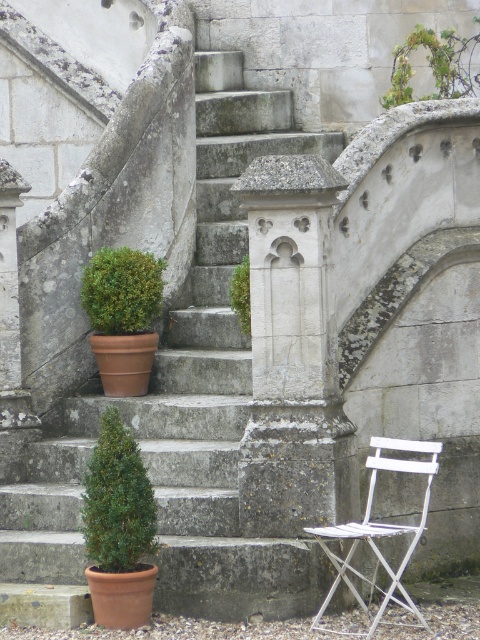
Is green matte hedge at lower left positioned before green mossy stone column at center?

Yes, it is.

Based on the photo, can you confirm if green matte hedge at lower left is positioned to the left of green mossy stone column at center?

Indeed, green matte hedge at lower left is positioned on the left side of green mossy stone column at center.

Image resolution: width=480 pixels, height=640 pixels. I want to click on green matte hedge at lower left, so click(118, 500).

Identify the location of smooth stone stairs at center. (177, 413).

Is point (51, 468) behind point (455, 77)?

That is False.

Where is `smooth stone stairs at center`? smooth stone stairs at center is located at coordinates (177, 413).

In the scene shown: Is smooth stone stairs at center below green matte hedge at upper center?

Yes, smooth stone stairs at center is below green matte hedge at upper center.

Is smooth stone stairs at center thinner than green matte hedge at upper center?

Yes, smooth stone stairs at center is thinner than green matte hedge at upper center.

Is point (259, 113) farther from camera compared to point (153, 282)?

Yes, it is behind point (153, 282).

You are a GUI agent. You are given a task and a screenshot of the screen. Output one action in this format:
    pyautogui.click(x=<x>, y=<y>)
    Task: Click on the smooth stone stairs at center
    
    Given the screenshot: What is the action you would take?
    pyautogui.click(x=177, y=413)